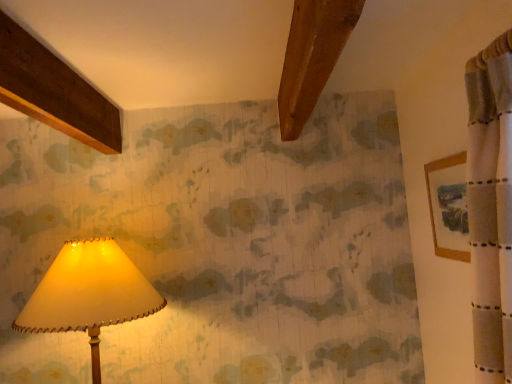
Identify the location of wooden framed picture at right. Image resolution: width=512 pixels, height=384 pixels. (448, 206).

What do you see at coordinates (448, 206) in the screenshot? The height and width of the screenshot is (384, 512). I see `wooden framed picture at right` at bounding box center [448, 206].

What do you see at coordinates (89, 294) in the screenshot? The image size is (512, 384). I see `matte cream lampshade at lower left` at bounding box center [89, 294].

Where is `matte cream lampshade at lower left`? This screenshot has width=512, height=384. matte cream lampshade at lower left is located at coordinates (89, 294).

The height and width of the screenshot is (384, 512). What are the coordinates of `wooden framed picture at right` in the screenshot? It's located at (448, 206).

In the image, is wooden framed picture at right on the left side or the right side of matte cream lampshade at lower left?

wooden framed picture at right is positioned on matte cream lampshade at lower left's right side.

Between wooden framed picture at right and matte cream lampshade at lower left, which one is positioned in front?

Positioned in front is wooden framed picture at right.

Is point (439, 249) closer or farther from the camera than point (51, 301)?

Clearly, point (439, 249) is more distant from the camera than point (51, 301).

From the image's perspective, which one is positioned higher, wooden framed picture at right or matte cream lampshade at lower left?

wooden framed picture at right, from the image's perspective.

From a real-world perspective, which object stands above the other?

From a 3D spatial view, wooden framed picture at right is above.

Looking at their sizes, would you say wooden framed picture at right is wider or thinner than matte cream lampshade at lower left?

In the image, wooden framed picture at right appears to be more narrow than matte cream lampshade at lower left.

Which of these two, wooden framed picture at right or matte cream lampshade at lower left, stands taller?

matte cream lampshade at lower left is taller.

Is wooden framed picture at right smaller than matte cream lampshade at lower left?

Yes, wooden framed picture at right is smaller than matte cream lampshade at lower left.

Is wooden framed picture at right outside of matte cream lampshade at lower left?

Yes, wooden framed picture at right is located beyond the bounds of matte cream lampshade at lower left.

Are wooden framed picture at right and matte cream lampshade at lower left far apart?

That's right, there is a large distance between wooden framed picture at right and matte cream lampshade at lower left.

Is wooden framed picture at right facing towards matte cream lampshade at lower left?

Yes, wooden framed picture at right is facing matte cream lampshade at lower left.

Can you tell me how much wooden framed picture at right and matte cream lampshade at lower left differ in facing direction?

They differ by 90.3 degrees in their facing directions.

How much distance is there between wooden framed picture at right and matte cream lampshade at lower left?

The distance of wooden framed picture at right from matte cream lampshade at lower left is 1.17 meters.

At what (x,y) coordinates should I click in order to perform the action: click on picture frame to the right of matte cream lampshade at lower left. Please return your answer as a coordinate pair (x, y). The image size is (512, 384). Looking at the image, I should click on (448, 206).

Considering the relative positions of matte cream lampshade at lower left and wooden framed picture at right in the image provided, is matte cream lampshade at lower left to the left of wooden framed picture at right from the viewer's perspective?

Yes, matte cream lampshade at lower left is to the left of wooden framed picture at right.

Which object is further away from the camera taking this photo, matte cream lampshade at lower left or wooden framed picture at right?

matte cream lampshade at lower left is behind.

Is point (65, 310) less distant than point (461, 190)?

No.

From the image's perspective, would you say matte cream lampshade at lower left is shown under wooden framed picture at right?

Yes.

From a real-world perspective, does matte cream lampshade at lower left sit lower than wooden framed picture at right?

Yes, from a real-world perspective, matte cream lampshade at lower left is below wooden framed picture at right.

Which of these two, matte cream lampshade at lower left or wooden framed picture at right, is wider?

With larger width is matte cream lampshade at lower left.

Which of these two, matte cream lampshade at lower left or wooden framed picture at right, stands shorter?

wooden framed picture at right is shorter.

Between matte cream lampshade at lower left and wooden framed picture at right, which one has smaller size?

wooden framed picture at right.

Is matte cream lampshade at lower left spatially inside wooden framed picture at right, or outside of it?

matte cream lampshade at lower left is not enclosed by wooden framed picture at right.

Is matte cream lampshade at lower left with wooden framed picture at right?

matte cream lampshade at lower left and wooden framed picture at right are not in contact.

From the picture: Could you tell me if matte cream lampshade at lower left is turned towards wooden framed picture at right?

No, matte cream lampshade at lower left does not turn towards wooden framed picture at right.

Measure the distance between matte cream lampshade at lower left and wooden framed picture at right.

A distance of 1.17 meters exists between matte cream lampshade at lower left and wooden framed picture at right.

Locate an element on the screen. This screenshot has height=384, width=512. picture frame in front of the matte cream lampshade at lower left is located at coordinates (448, 206).

Locate an element on the screen. lamp below the wooden framed picture at right (from the image's perspective) is located at coordinates (89, 294).

Identify the location of lamp that appears behind the wooden framed picture at right. Image resolution: width=512 pixels, height=384 pixels. (89, 294).